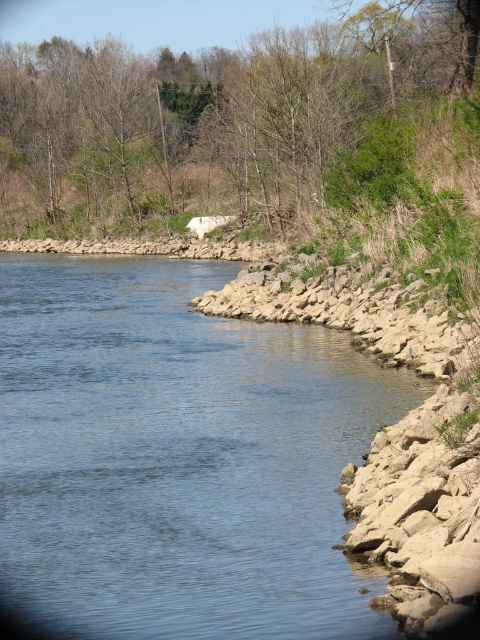
The width and height of the screenshot is (480, 640). Describe the element at coordinates (179, 456) in the screenshot. I see `blue stone river at lower right` at that location.

The height and width of the screenshot is (640, 480). What do you see at coordinates (179, 456) in the screenshot?
I see `blue stone river at lower right` at bounding box center [179, 456].

The height and width of the screenshot is (640, 480). What are the coordinates of `blue stone river at lower right` in the screenshot? It's located at (179, 456).